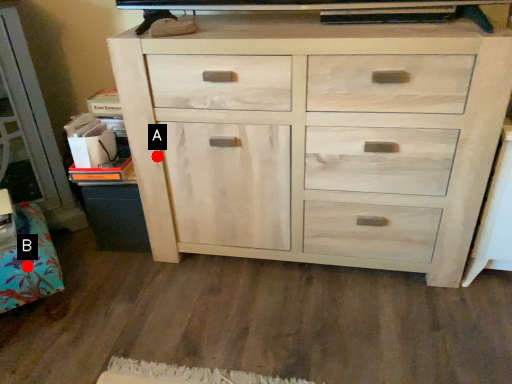
Question: Two points are circled on the image, labeled by A and B beside each circle. Which point is closer to the camera taking this photo?

Choices:
 (A) A is closer
 (B) B is closer

Answer: (B)